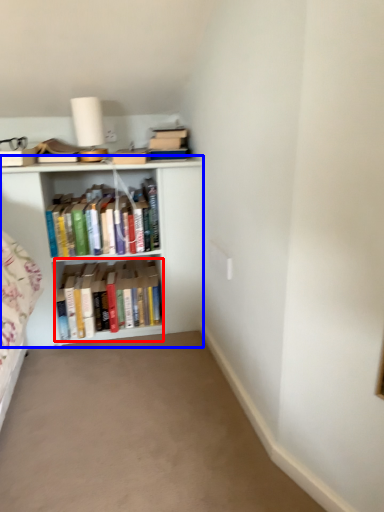
Question: Which of the following is the closest to the observer, book (highlighted by a red box) or shelf (highlighted by a blue box)?

Choices:
 (A) book
 (B) shelf

Answer: (B)